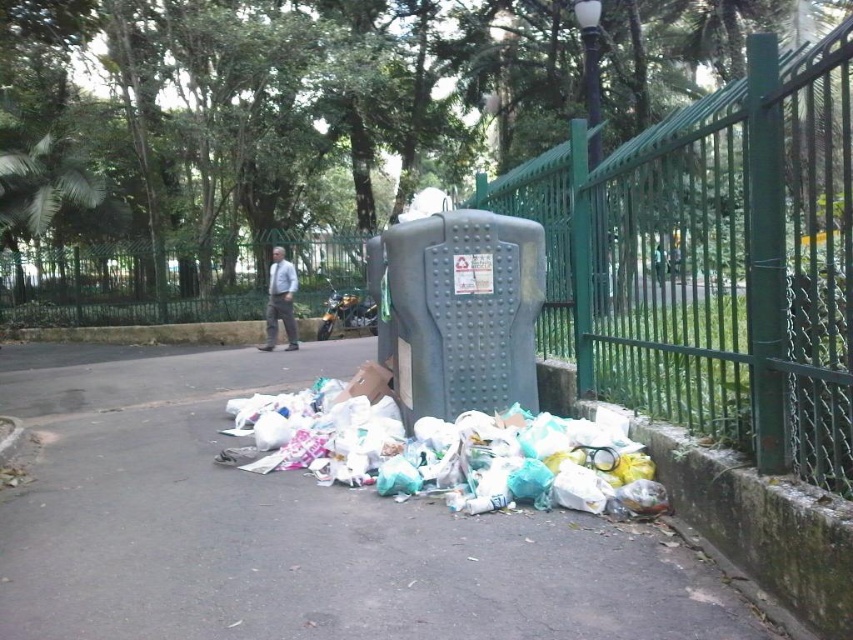
Question: Is the position of green metal fence at upper right less distant than that of matte gray pants at center?

Choices:
 (A) yes
 (B) no

Answer: (A)

Question: Among these points, which one is nearest to the camera?

Choices:
 (A) (325, 280)
 (B) (775, 433)

Answer: (B)

Question: Estimate the real-world distances between objects in this image. Which object is closer to the green concrete curb at lower right?

Choices:
 (A) plastic bags at lower center
 (B) green metal fence at upper right

Answer: (B)

Question: Can you confirm if trashy asphalt pavement at lower center is thinner than matte gray pants at center?

Choices:
 (A) yes
 (B) no

Answer: (B)

Question: Is trashy asphalt pavement at lower center bigger than green metal fence at center?

Choices:
 (A) yes
 (B) no

Answer: (B)

Question: Which point is closer to the camera?

Choices:
 (A) (201, 417)
 (B) (711, 378)
 (C) (271, 326)

Answer: (B)